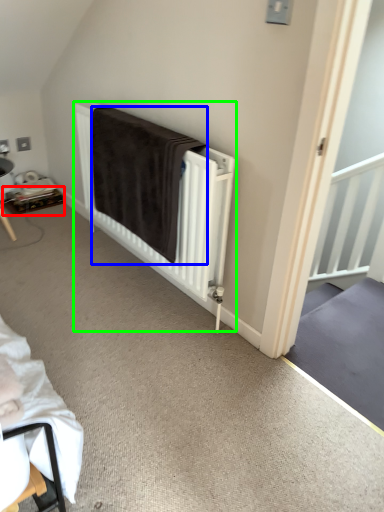
Question: Which object is the closest to the table (highlighted by a red box)? Choose among these: blanket (highlighted by a blue box) or bed (highlighted by a green box).

Choices:
 (A) blanket
 (B) bed

Answer: (A)